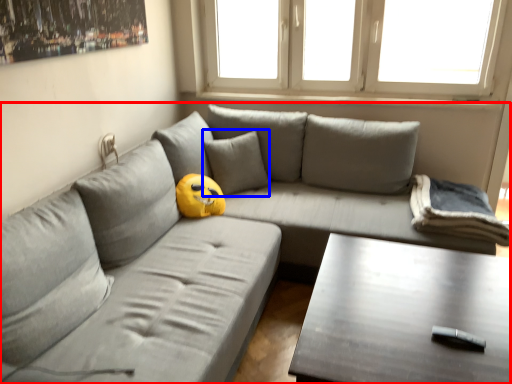
Question: Which object is closer to the camera taking this photo, studio couch (highlighted by a red box) or pillow (highlighted by a blue box)?

Choices:
 (A) studio couch
 (B) pillow

Answer: (A)